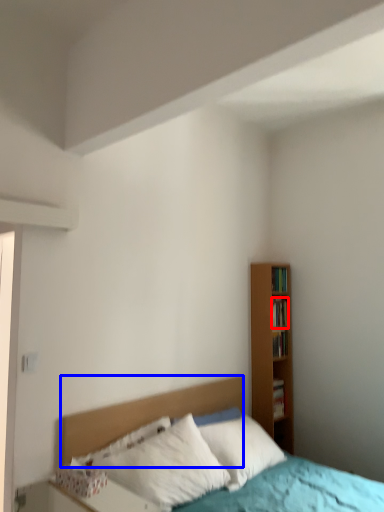
Question: Which object is further to the camera taking this photo, book (highlighted by a red box) or headboard (highlighted by a blue box)?

Choices:
 (A) book
 (B) headboard

Answer: (A)